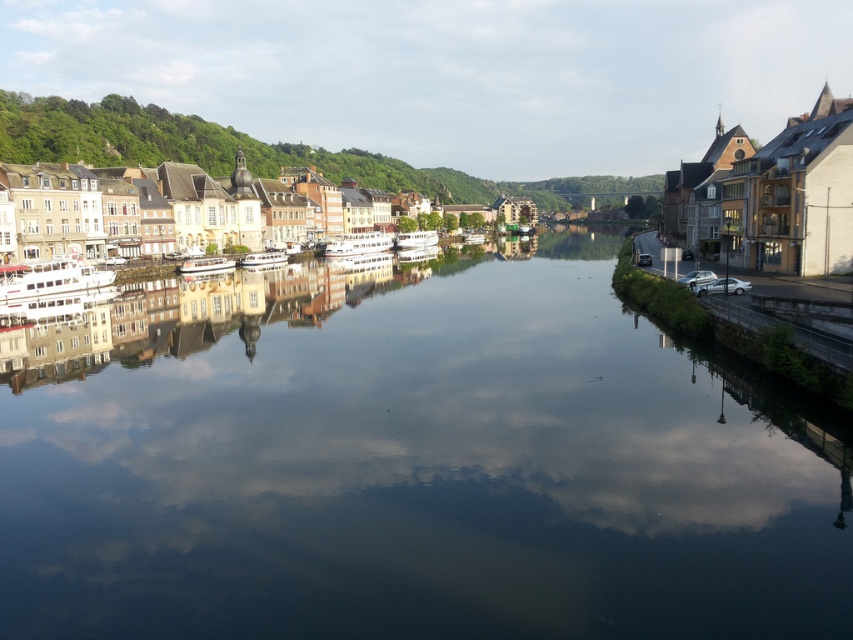
Is matte yellow building at left to the left of green leafy hillside at upper left from the viewer's perspective?

No, matte yellow building at left is not to the left of green leafy hillside at upper left.

From the picture: Can you confirm if matte yellow building at left is positioned to the right of green leafy hillside at upper left?

Correct, you'll find matte yellow building at left to the right of green leafy hillside at upper left.

Locate an element on the screen. matte yellow building at left is located at coordinates (194, 205).

Image resolution: width=853 pixels, height=640 pixels. In order to click on matte yellow building at left in this screenshot , I will do (194, 205).

Can you confirm if smooth reflective water at center is positioned above green leafy hillside at upper left?

No, smooth reflective water at center is not above green leafy hillside at upper left.

Does smooth reflective water at center have a greater width compared to green leafy hillside at upper left?

In fact, smooth reflective water at center might be narrower than green leafy hillside at upper left.

Identify the location of smooth reflective water at center. pos(409,464).

Looking at this image, how distant is smooth reflective water at center from matte yellow building at left?

A distance of 79.28 meters exists between smooth reflective water at center and matte yellow building at left.

Is smooth reflective water at center positioned at the back of matte yellow building at left?

No, smooth reflective water at center is in front of matte yellow building at left.

Is point (204, 628) farther from viewer compared to point (212, 230)?

That is False.

This screenshot has width=853, height=640. Find the location of `smooth reflective water at center`. smooth reflective water at center is located at coordinates (409, 464).